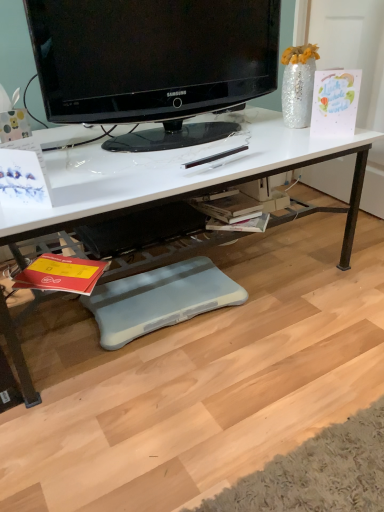
Question: From the image's perspective, is black glossy television at upper center positioned above or below blue foam footrest at lower center?

Choices:
 (A) below
 (B) above

Answer: (B)

Question: Is black glossy television at upper center to the left or to the right of blue foam footrest at lower center in the image?

Choices:
 (A) left
 (B) right

Answer: (B)

Question: Considering the real-world distances, which object is farthest from the black glossy television at upper center?

Choices:
 (A) white glossy desk at center
 (B) blue foam footrest at lower center

Answer: (B)

Question: Estimate the real-world distances between objects in this image. Which object is closer to the black glossy television at upper center?

Choices:
 (A) blue foam footrest at lower center
 (B) white glossy desk at center

Answer: (B)